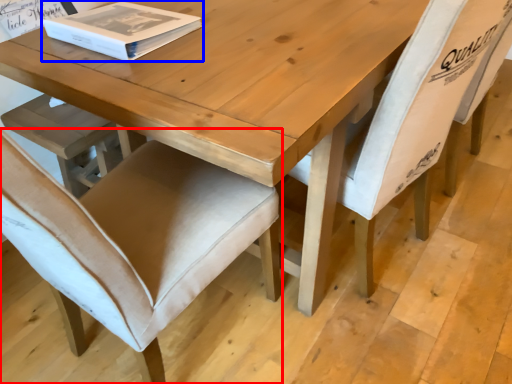
Question: Which of the following is the closest to the observer, chair (highlighted by a red box) or box (highlighted by a blue box)?

Choices:
 (A) chair
 (B) box

Answer: (A)